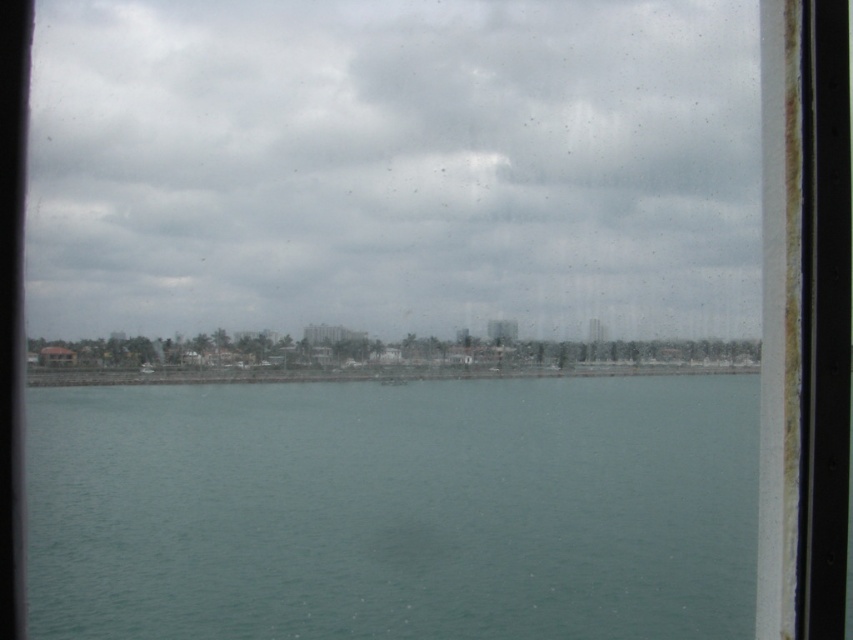
Question: Does cloudy sky at upper center have a larger size compared to teal smooth water at center?

Choices:
 (A) yes
 (B) no

Answer: (A)

Question: Is cloudy sky at upper center to the right of teal smooth water at center from the viewer's perspective?

Choices:
 (A) no
 (B) yes

Answer: (B)

Question: Among these points, which one is nearest to the camera?

Choices:
 (A) (97, 529)
 (B) (175, 65)

Answer: (A)

Question: Observing the image, what is the correct spatial positioning of cloudy sky at upper center in reference to teal smooth water at center?

Choices:
 (A) below
 (B) above

Answer: (B)

Question: Which object is farther from the camera taking this photo?

Choices:
 (A) cloudy sky at upper center
 (B) teal smooth water at center

Answer: (A)